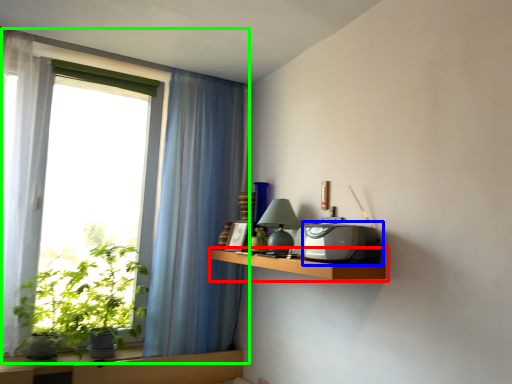
Question: Which is farther away from shelf (highlighted by a red box)? appliance (highlighted by a blue box) or window (highlighted by a green box)?

Choices:
 (A) appliance
 (B) window

Answer: (B)